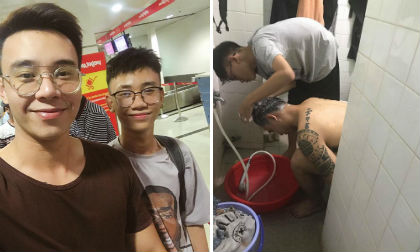
Find the location of a particular element. The image size is (420, 252). signs on ceiling is located at coordinates (110, 48), (122, 46).